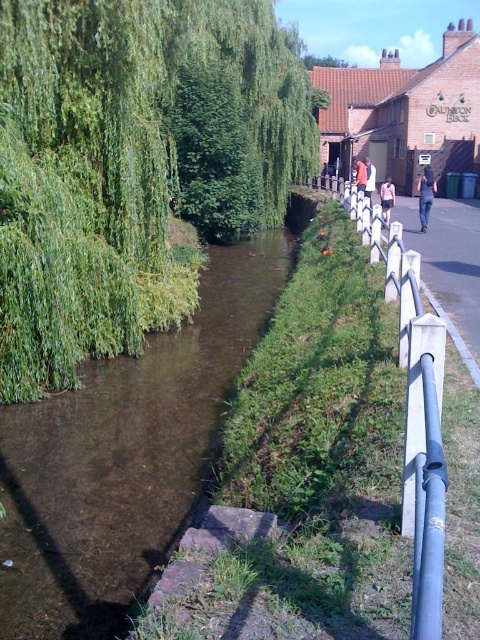
Based on the photo, you are standing on the riverside path and see the jeans at right and the white cotton shirt at center. Which clothing item is closer to you?

The jeans at right are closer to you than the white cotton shirt at center because they are further to the viewer.

You are standing at the riverside and want to take a photo of the green leafy tree at upper left and the white cotton shirt at center. How far apart are these two objects in feet?

The green leafy tree at upper left is 24.63 feet from the white cotton shirt at center.